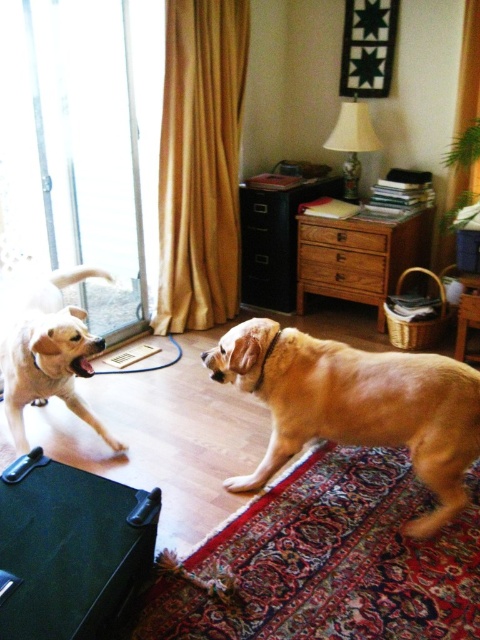
You are standing at the center of the living room. There is a point marked at coordinates point [82,156]. What object is located at this point?

The point [82,156] marks the transparent glass door at left.

You are a guest entering the living room and want to know if you can see the golden fur dog at left through the transparent glass door at left. Can you see the dog through the door?

The transparent glass door at left is taller than golden fur dog at left, so yes, you can see the golden fur dog at left through the transparent glass door at left because the door is taller and likely extends beyond the dog vertically, allowing visibility.